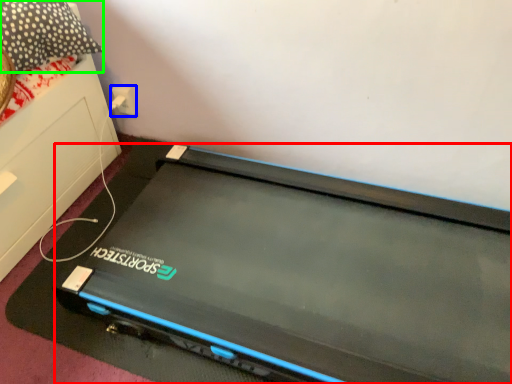
Question: Considering the real-world distances, which object is closest to computer (highlighted by a red box)? electric outlet (highlighted by a blue box) or pillow (highlighted by a green box).

Choices:
 (A) electric outlet
 (B) pillow

Answer: (B)